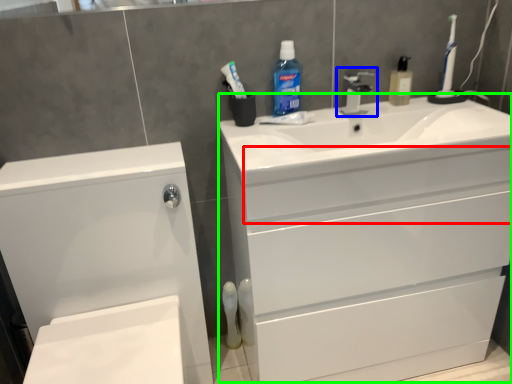
Question: Based on their relative distances, which object is farther from drawer (highlighted by a red box)? Choose from tap (highlighted by a blue box) and counter top (highlighted by a green box).

Choices:
 (A) tap
 (B) counter top

Answer: (A)